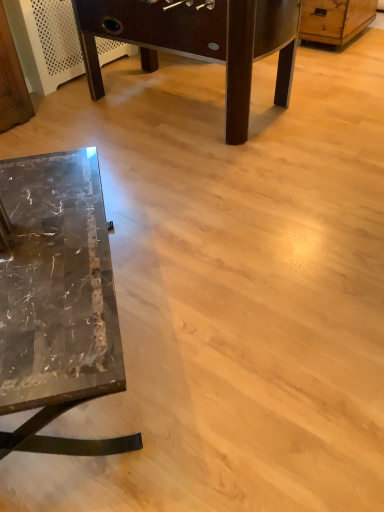
Question: Is marble table at lower left, which appears as the 1th table when viewed from the front, to the left or to the right of marble table at lower left, which ranks as the second table in front-to-back order, in the image?

Choices:
 (A) right
 (B) left

Answer: (B)

Question: Looking at the image, does marble table at lower left, the first table when ordered from bottom to top, seem bigger or smaller compared to marble table at lower left, which ranks as the second table in front-to-back order?

Choices:
 (A) small
 (B) big

Answer: (A)

Question: Estimate the real-world distances between objects in this image. Which object is closer to the wooden dresser at upper right?

Choices:
 (A) marble table at lower left, which is the second table in back-to-front order
 (B) marble table at lower left, which is the 2th table in bottom-to-top order

Answer: (B)

Question: Estimate the real-world distances between objects in this image. Which object is closer to the wooden dresser at upper right?

Choices:
 (A) marble table at lower left, which appears as the 1th table when viewed from the front
 (B) marble table at lower left, which is the 2th table in bottom-to-top order

Answer: (B)